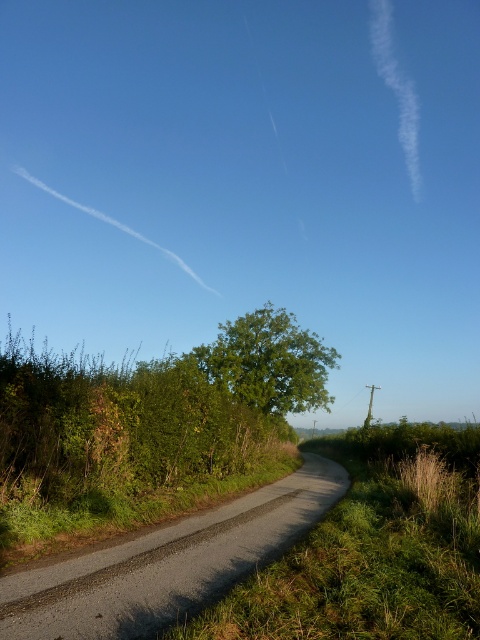
The width and height of the screenshot is (480, 640). Describe the element at coordinates (166, 563) in the screenshot. I see `gravel road at center` at that location.

Does gravel road at center have a lesser width compared to green leafy tree at center?

Yes, gravel road at center is thinner than green leafy tree at center.

Locate an element on the screen. This screenshot has height=640, width=480. gravel road at center is located at coordinates (166, 563).